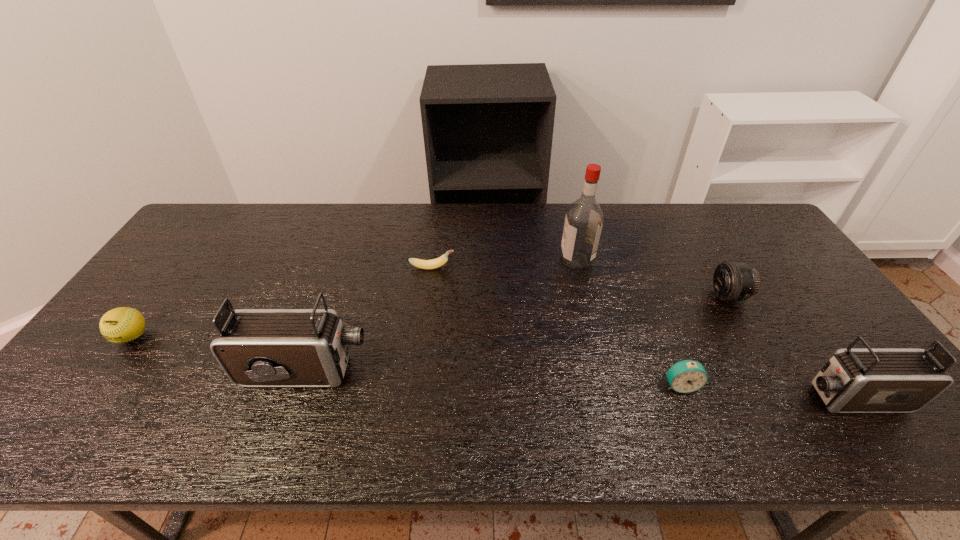
This screenshot has height=540, width=960. Identify the location of free space located on the front-facing side of the fourth object from right to left. (514, 259).

The width and height of the screenshot is (960, 540). In order to click on vacant area situated on the front-facing side of the fourth object from right to left in this screenshot , I will do `click(536, 259)`.

The width and height of the screenshot is (960, 540). I want to click on free spot located on the front-facing side of the fourth object from right to left, so click(x=439, y=259).

Where is `vacant space situated 0.270m at the stem of the banana`? Image resolution: width=960 pixels, height=540 pixels. vacant space situated 0.270m at the stem of the banana is located at coordinates (541, 268).

Locate an element on the screen. This screenshot has width=960, height=540. vacant space located on the logo side of the fourth nearest object is located at coordinates (84, 402).

I want to click on alarm clock present at the near edge, so click(685, 376).

Locate an element on the screen. The image size is (960, 540). object that is at the left edge is located at coordinates (120, 325).

In order to click on object at the right edge in this screenshot , I will do `click(868, 380)`.

Locate an element on the screen. object at the near right corner is located at coordinates (868, 380).

This screenshot has width=960, height=540. In the image, there is a desktop. What are the coordinates of `free space at the far edge` in the screenshot? It's located at (268, 225).